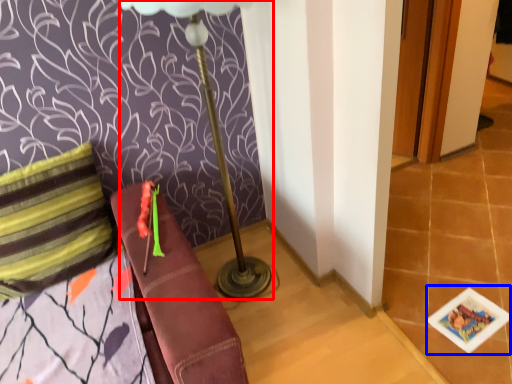
Question: Which of the following is the farthest to the observer, table lamp (highlighted by a red box) or card game (highlighted by a blue box)?

Choices:
 (A) table lamp
 (B) card game

Answer: (B)